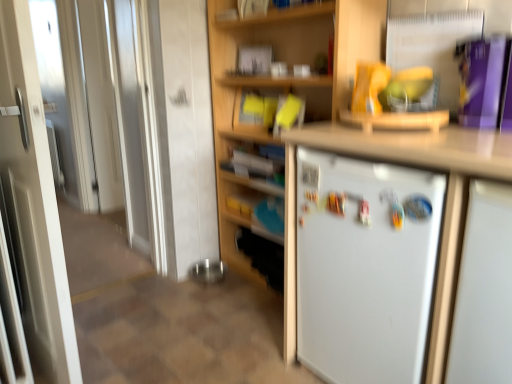
Question: Can you confirm if white glossy door at left is wider than white glossy door at left?

Choices:
 (A) no
 (B) yes

Answer: (B)

Question: Can you confirm if white glossy door at left is positioned to the left of white glossy door at left?

Choices:
 (A) no
 (B) yes

Answer: (A)

Question: Considering the relative sizes of white glossy door at left and white glossy door at left in the image provided, is white glossy door at left thinner than white glossy door at left?

Choices:
 (A) no
 (B) yes

Answer: (A)

Question: Is white glossy door at left closer to camera compared to white glossy door at left?

Choices:
 (A) yes
 (B) no

Answer: (B)

Question: Would you say white glossy door at left is part of white glossy door at left's contents?

Choices:
 (A) no
 (B) yes

Answer: (A)

Question: Can you confirm if white glossy door at left is taller than white glossy door at left?

Choices:
 (A) yes
 (B) no

Answer: (A)

Question: Is wooden bookshelf at center oriented towards white matte refrigerator at right?

Choices:
 (A) no
 (B) yes

Answer: (A)

Question: Would you say wooden bookshelf at center is outside white matte refrigerator at right?

Choices:
 (A) yes
 (B) no

Answer: (A)

Question: Is white matte refrigerator at right inside wooden bookshelf at center?

Choices:
 (A) no
 (B) yes

Answer: (A)

Question: Is wooden bookshelf at center looking in the opposite direction of white matte refrigerator at right?

Choices:
 (A) yes
 (B) no

Answer: (B)

Question: Is wooden bookshelf at center in front of white matte refrigerator at right?

Choices:
 (A) no
 (B) yes

Answer: (A)

Question: Does wooden bookshelf at center have a lesser width compared to white matte refrigerator at right?

Choices:
 (A) yes
 (B) no

Answer: (A)

Question: Is white glossy door at left turned away from white matte refrigerator at right?

Choices:
 (A) no
 (B) yes

Answer: (A)